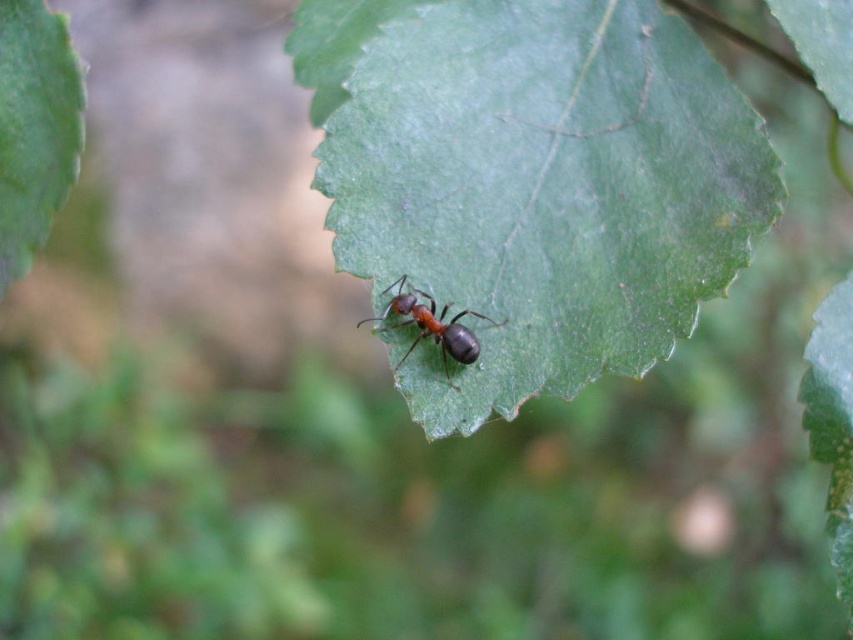
Can you confirm if green matte leaf at center is shorter than shiny black ant at center?

In fact, green matte leaf at center may be taller than shiny black ant at center.

Measure the distance from green matte leaf at center to shiny black ant at center.

The distance of green matte leaf at center from shiny black ant at center is 21.39 centimeters.

Is point (468, 120) farther from camera compared to point (442, 316)?

Yes, point (468, 120) is farther from viewer.

Locate an element on the screen. Image resolution: width=853 pixels, height=640 pixels. green matte leaf at center is located at coordinates (532, 180).

Which is more to the left, green matte leaf at center or green matte leaf at upper left?

From the viewer's perspective, green matte leaf at upper left appears more on the left side.

Is green matte leaf at center shorter than green matte leaf at upper left?

In fact, green matte leaf at center may be taller than green matte leaf at upper left.

Where is `green matte leaf at center`? green matte leaf at center is located at coordinates (532, 180).

Is the position of green matte leaf at upper left less distant than that of shiny black ant at center?

Yes, green matte leaf at upper left is closer to the viewer.

Between point (10, 97) and point (480, 317), which one is positioned behind?

Positioned behind is point (480, 317).

From the picture: Who is more forward, (45, 96) or (405, 314)?

Point (45, 96)

Locate an element on the screen. The height and width of the screenshot is (640, 853). green matte leaf at upper left is located at coordinates (33, 128).